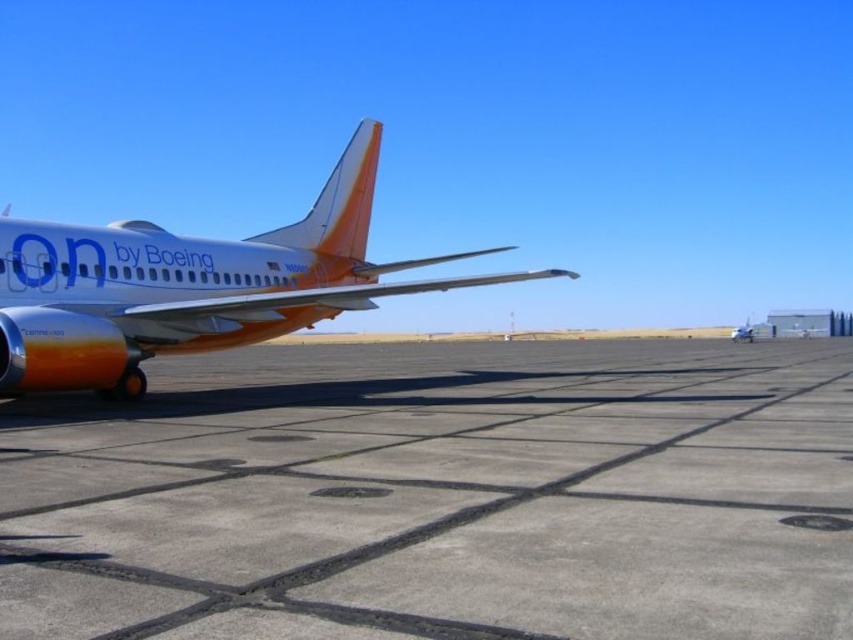
Does point (840, 384) come closer to viewer compared to point (276, 333)?

Yes, point (840, 384) is closer to viewer.

Describe the element at coordinates (440, 496) in the screenshot. The width and height of the screenshot is (853, 640). I see `concrete at center` at that location.

The width and height of the screenshot is (853, 640). In order to click on concrete at center in this screenshot , I will do `click(440, 496)`.